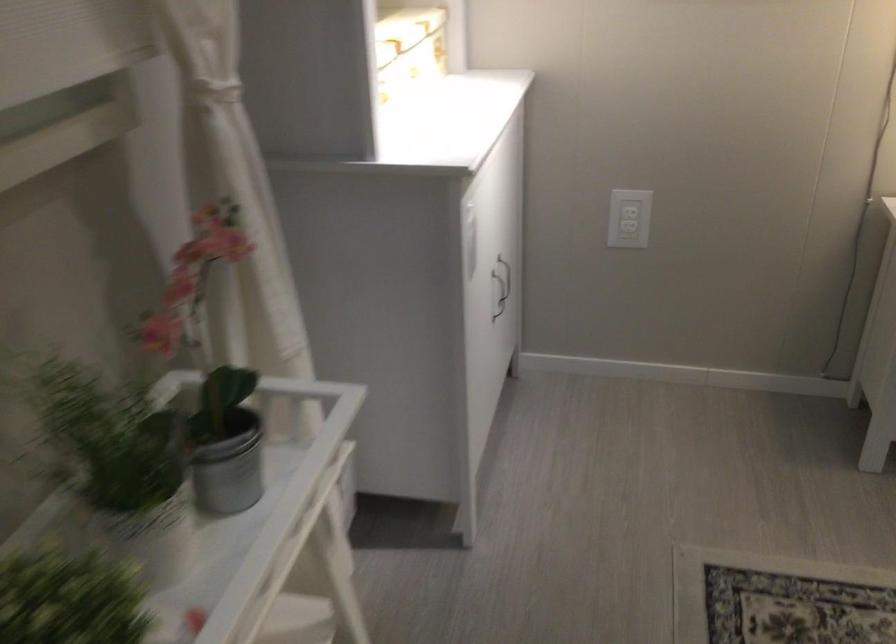
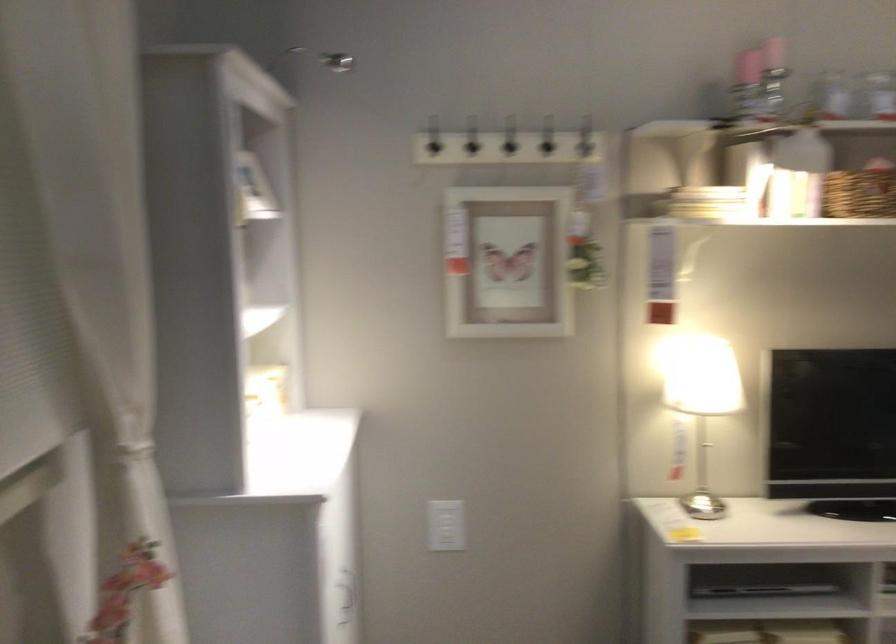
Locate, in the second image, the point that corresponds to point 625,213 in the first image.

(445, 526)